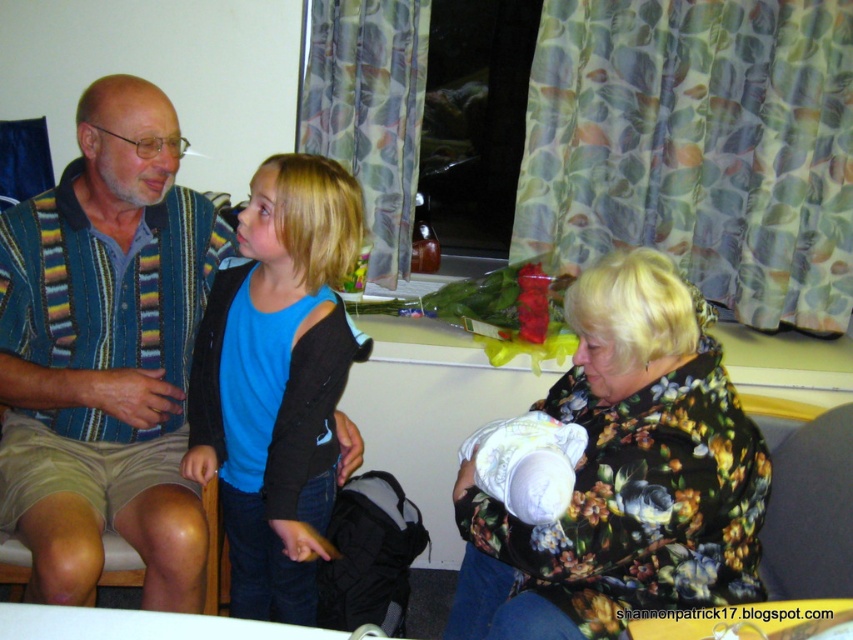
You are helping to organize a clothing donation drive. You have a donation box that can only fit items wider than 40 cm. You need to decide which of the striped fabric shirt at left or the blue cotton shirt at center should be placed in the box based on their widths. Which shirt should you choose?

The striped fabric shirt at left should be placed in the donation box because its width is larger than the blue cotton shirt at center, and it meets the requirement of being wider than 40 cm.

You are designing a gift box for a clothing store. The box must fit either the striped fabric shirt at left or the blue cotton shirt at center. Which shirt requires a larger box?

The blue cotton shirt at center requires a larger box because the striped fabric shirt at left is smaller than it.